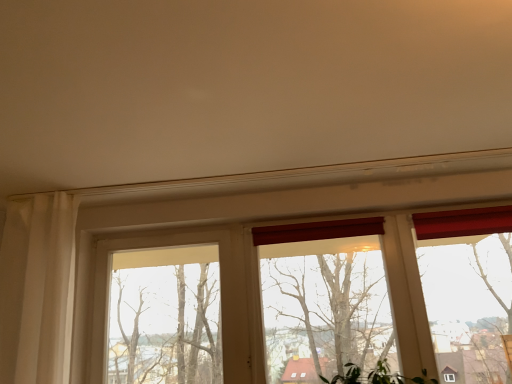
What is the approximate height of bare branches at center?

bare branches at center is 32.53 inches tall.

Describe the element at coordinates (165, 325) in the screenshot. The image size is (512, 384). I see `bare branches at center` at that location.

The width and height of the screenshot is (512, 384). Find the location of `bare branches at center`. bare branches at center is located at coordinates (165, 325).

Identify the location of bare branches at center. (165, 325).